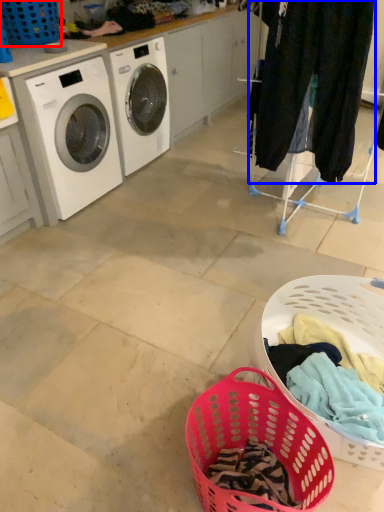
Question: Which of the following is the farthest to the observer, basket (highlighted by a red box) or clothing (highlighted by a blue box)?

Choices:
 (A) basket
 (B) clothing

Answer: (A)